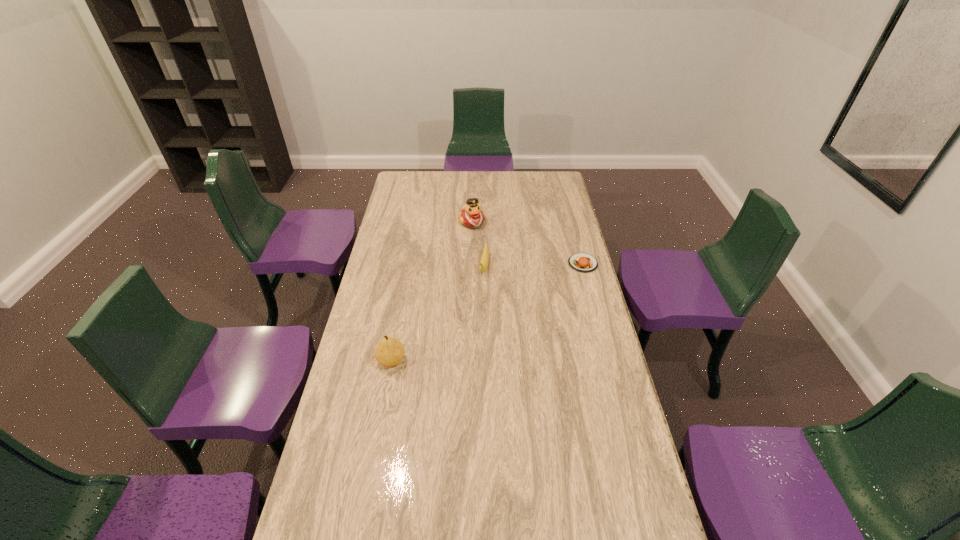
Where is `free spot on the desktop that is between the leftmost object and the patty (food) and is positioned at the stem of the banana`? This screenshot has height=540, width=960. free spot on the desktop that is between the leftmost object and the patty (food) and is positioned at the stem of the banana is located at coordinates (474, 318).

Identify the location of vacant space on the desktop that is between the nearest object and the shortest object and is positioned on the face of the farthest object. (519, 295).